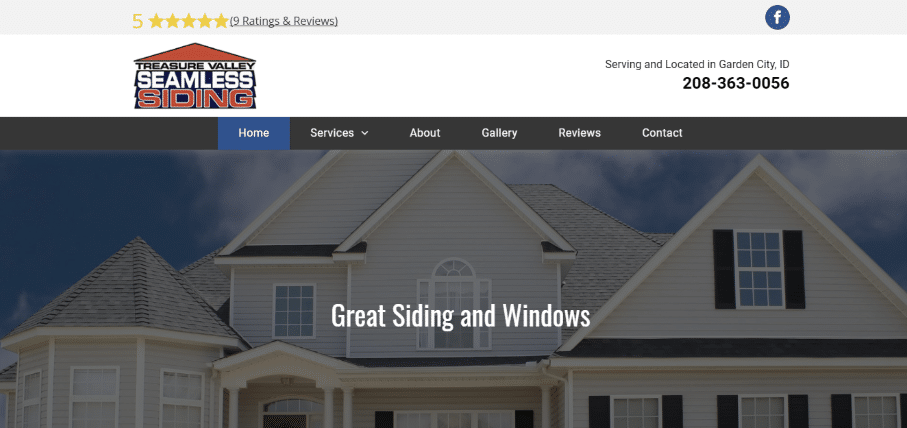
You are a GUI agent. You are given a task and a screenshot of the screen. Output one action in this format:
    pyautogui.click(x=<x>, y=<y>)
    Task: Click on the picture/photo
    The image size is (907, 428).
    Given the screenshot: What is the action you would take?
    pyautogui.click(x=573, y=191)